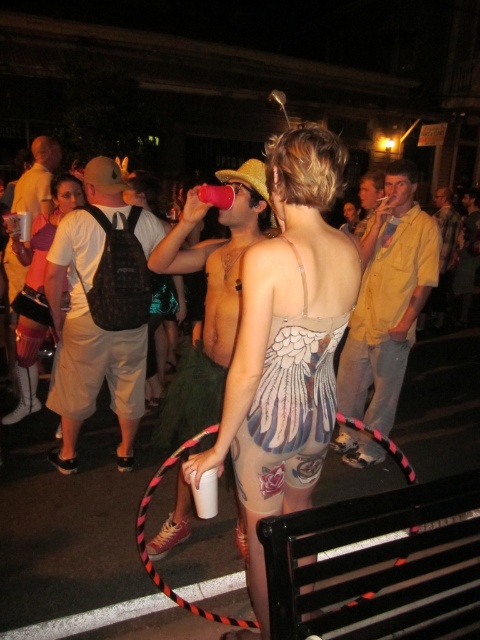
Question: Among these objects, which one is nearest to the camera?

Choices:
 (A) matte metallic dress at center
 (B) white cotton t-shirt at left

Answer: (A)

Question: Which of the following is the farthest from the observer?

Choices:
 (A) (44, 324)
 (B) (307, 259)

Answer: (A)

Question: Is matte metallic dress at center wider than white cotton t-shirt at left?

Choices:
 (A) no
 (B) yes

Answer: (A)

Question: Which point is farther to the camera?

Choices:
 (A) (335, 168)
 (B) (26, 381)

Answer: (B)

Question: Does matte metallic dress at center appear on the right side of white cotton t-shirt at left?

Choices:
 (A) no
 (B) yes

Answer: (B)

Question: Does matte metallic dress at center have a lesser width compared to white cotton t-shirt at left?

Choices:
 (A) no
 (B) yes

Answer: (B)